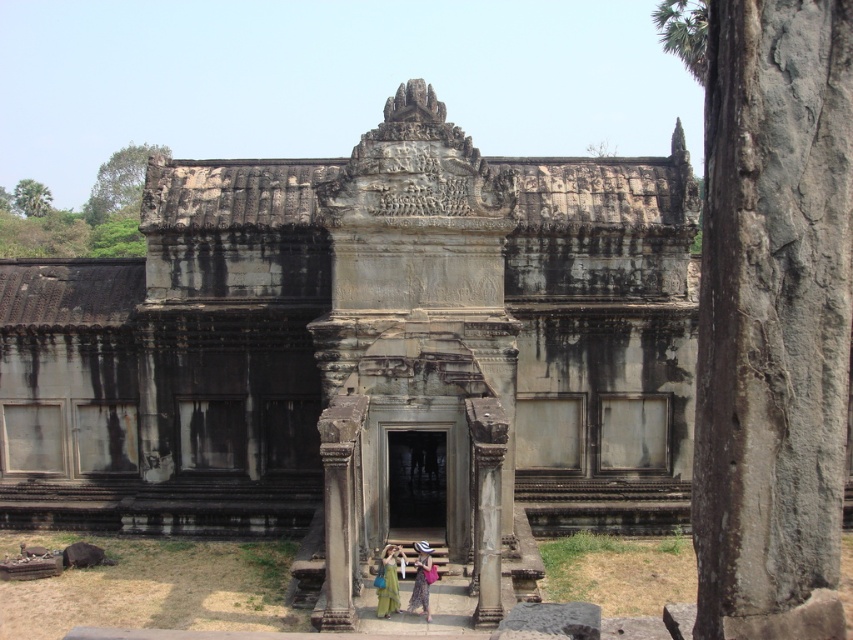
Question: Which point appears closest to the camera in this image?

Choices:
 (A) (795, 131)
 (B) (389, 564)
 (C) (602, 168)
 (D) (421, 579)

Answer: (A)

Question: Is gray stone ruins at center positioned in front of gray stone pillar at center?

Choices:
 (A) yes
 (B) no

Answer: (B)

Question: Which of the following is the farthest from the observer?

Choices:
 (A) green dress at center
 (B) gray stone pillar at center
 (C) green silk dress at center

Answer: (C)

Question: Among these objects, which one is nearest to the camera?

Choices:
 (A) green dress at center
 (B) gray stone ruins at center

Answer: (B)

Question: Is gray stone ruins at center positioned behind green silk dress at center?

Choices:
 (A) no
 (B) yes

Answer: (A)

Question: In this image, where is gray stone pillar at center located relative to green dress at center?

Choices:
 (A) left
 (B) right

Answer: (B)